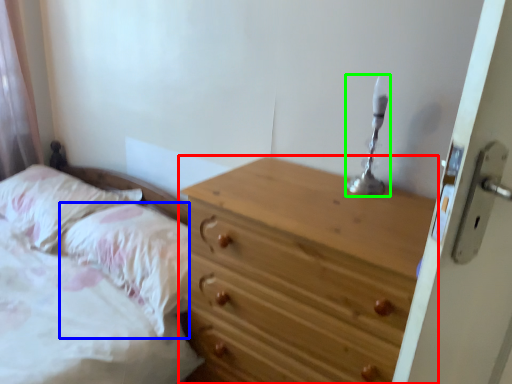
Question: Based on their relative distances, which object is farther from chest of drawers (highlighted by a red box)? Choose from pillow (highlighted by a blue box) and candle holder (highlighted by a green box).

Choices:
 (A) pillow
 (B) candle holder

Answer: (A)